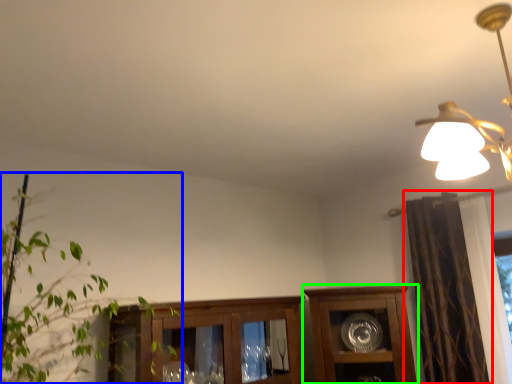
Question: Which is farther away from curtain (highlighted by a red box)? houseplant (highlighted by a blue box) or cabinetry (highlighted by a green box)?

Choices:
 (A) houseplant
 (B) cabinetry

Answer: (A)